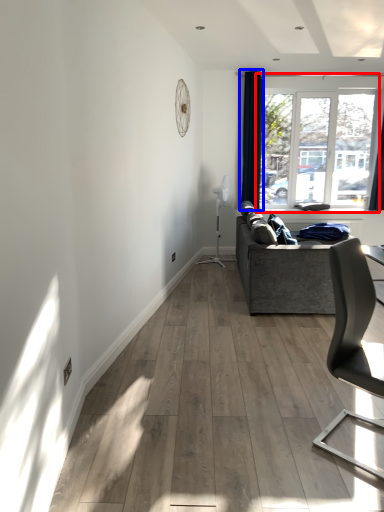
Question: Which object appears farthest to the camera in this image, window (highlighted by a red box) or curtain (highlighted by a blue box)?

Choices:
 (A) window
 (B) curtain

Answer: (A)